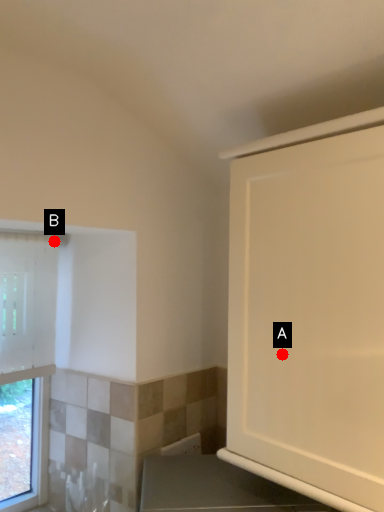
Question: Two points are circled on the image, labeled by A and B beside each circle. Which of the following is the farthest from the observer?

Choices:
 (A) A is further
 (B) B is further

Answer: (B)